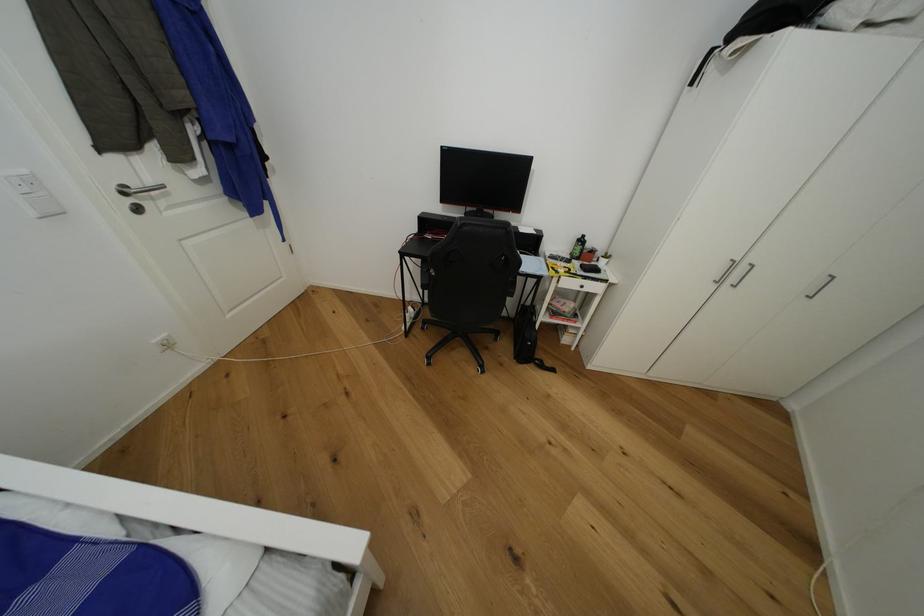
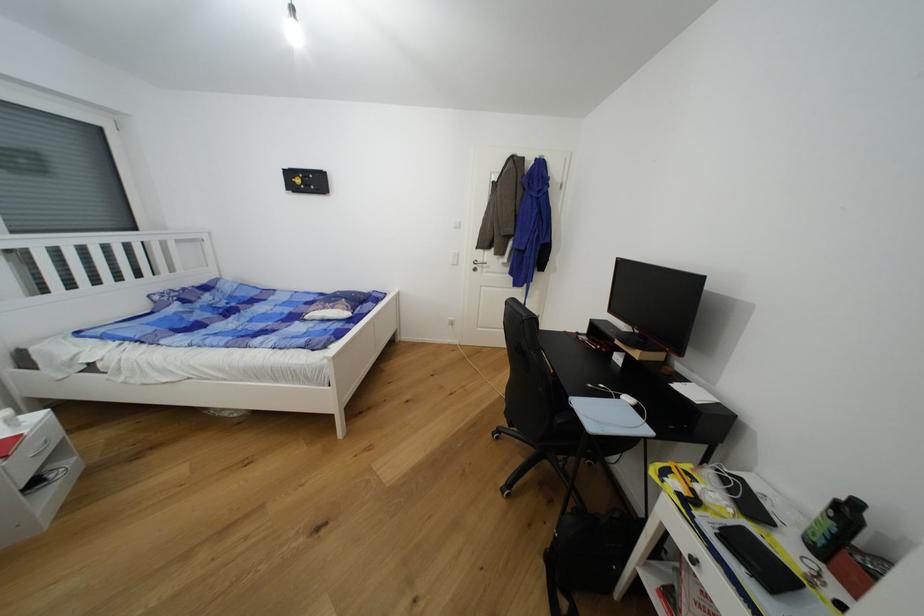
The point at (589, 238) is marked in the first image. Where is the corresponding point in the second image?

(862, 506)